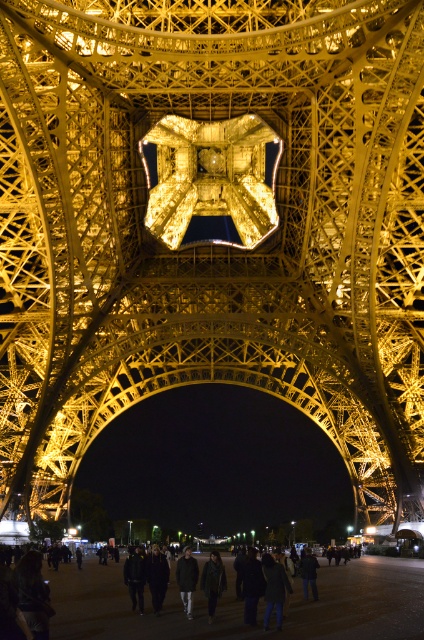
You are standing on the pathway near the Eiffel Tower at night. You notice two points marked on the ground in front of you. The first point is labeled as point (287, 632), and the second is point (189, 614). Which point is closer to your current position?

Point (287, 632) is closer to the viewer than point (189, 614).